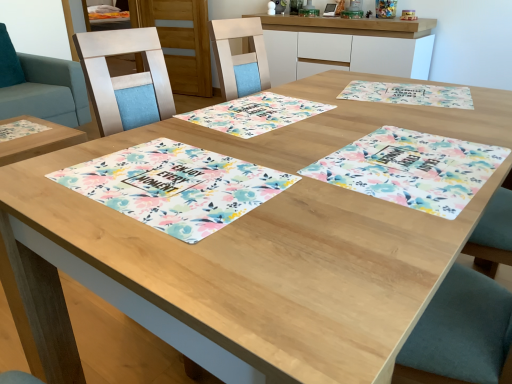
Measure the distance between floral fabric placemat at center, arranged as the 3th place mat when viewed from the right, and camera.

floral fabric placemat at center, arranged as the 3th place mat when viewed from the right, and camera are 3.64 feet apart from each other.

Measure the distance between point (300, 111) and camera.

They are 4.46 feet apart.

In order to click on floral fabric placemat at upper right, which is the fourth place mat in left-to-right order in this screenshot , I will do `click(408, 94)`.

This screenshot has width=512, height=384. What do you see at coordinates (408, 94) in the screenshot? I see `floral fabric placemat at upper right, marked as the first place mat in a right-to-left arrangement` at bounding box center [408, 94].

How much space does wooden cabinet at upper center, acting as the first cabinetry starting from the back, occupy horizontally?

It is 4.68 inches.

The height and width of the screenshot is (384, 512). Describe the element at coordinates (346, 46) in the screenshot. I see `white glossy cabinet at upper center, marked as the first cabinetry in a right-to-left arrangement` at that location.

This screenshot has height=384, width=512. I want to click on teal fabric swivel chair at upper left, so click(x=41, y=86).

This screenshot has height=384, width=512. Identify the location of floral fabric placemat at center, positioned as the third place mat in left-to-right order. (411, 169).

Based on their sizes in the image, would you say teal fabric swivel chair at upper left is bigger or smaller than floral fabric placemat at upper right, which is the fourth place mat in left-to-right order?

Considering their sizes, teal fabric swivel chair at upper left takes up more space than floral fabric placemat at upper right, which is the fourth place mat in left-to-right order.

Does teal fabric swivel chair at upper left have a lesser height compared to floral fabric placemat at upper right, which is the fourth place mat in left-to-right order?

In fact, teal fabric swivel chair at upper left may be taller than floral fabric placemat at upper right, which is the fourth place mat in left-to-right order.

Is floral fabric placemat at upper right, which is the fourth place mat in left-to-right order, inside teal fabric swivel chair at upper left?

No, teal fabric swivel chair at upper left does not contain floral fabric placemat at upper right, which is the fourth place mat in left-to-right order.

Considering the relative positions of white glossy cabinet at upper center, which is counted as the second cabinetry, starting from the left, and teal fabric swivel chair at upper left in the image provided, is white glossy cabinet at upper center, which is counted as the second cabinetry, starting from the left, to the left or to the right of teal fabric swivel chair at upper left?

white glossy cabinet at upper center, which is counted as the second cabinetry, starting from the left, is positioned on teal fabric swivel chair at upper left's right side.

Can you confirm if white glossy cabinet at upper center, which is counted as the second cabinetry, starting from the left, is shorter than teal fabric swivel chair at upper left?

Yes.

In the scene shown: From a real-world perspective, is white glossy cabinet at upper center, which is counted as the second cabinetry, starting from the left, under teal fabric swivel chair at upper left?

No, from a real-world perspective, white glossy cabinet at upper center, which is counted as the second cabinetry, starting from the left, is not below teal fabric swivel chair at upper left.

Measure the distance between white glossy cabinet at upper center, the 1th cabinetry viewed from the front, and teal fabric swivel chair at upper left.

white glossy cabinet at upper center, the 1th cabinetry viewed from the front, is 6.23 feet from teal fabric swivel chair at upper left.

In the scene shown: Between wooden cabinet at upper center, acting as the first cabinetry starting from the back, and floral fabric placemat at center, which is counted as the 4th place mat, starting from the right, which one has less height?

floral fabric placemat at center, which is counted as the 4th place mat, starting from the right.

Is floral fabric placemat at center, which is counted as the 4th place mat, starting from the right, completely or partially inside wooden cabinet at upper center, acting as the first cabinetry starting from the left?

No, floral fabric placemat at center, which is counted as the 4th place mat, starting from the right, is not a part of wooden cabinet at upper center, acting as the first cabinetry starting from the left.

Looking at this image, what's the angular difference between wooden cabinet at upper center, which ranks as the second cabinetry in right-to-left order, and floral fabric placemat at center, the 1th place mat when ordered from left to right,'s facing directions?

104 degrees separate the facing orientations of wooden cabinet at upper center, which ranks as the second cabinetry in right-to-left order, and floral fabric placemat at center, the 1th place mat when ordered from left to right.

Would you say floral fabric placemat at center, the 1th place mat when ordered from left to right, is a long distance from floral fabric placemat at upper right, which is the fourth place mat in left-to-right order?

That's not correct — floral fabric placemat at center, the 1th place mat when ordered from left to right, is a little close to floral fabric placemat at upper right, which is the fourth place mat in left-to-right order.

Looking at this image, considering the sizes of objects floral fabric placemat at center, which is counted as the 4th place mat, starting from the right, and floral fabric placemat at upper right, marked as the first place mat in a right-to-left arrangement, in the image provided, who is bigger, floral fabric placemat at center, which is counted as the 4th place mat, starting from the right, or floral fabric placemat at upper right, marked as the first place mat in a right-to-left arrangement,?

floral fabric placemat at center, which is counted as the 4th place mat, starting from the right.

From the image's perspective, which place mat is the 3rd one below the floral fabric placemat at upper right, marked as the first place mat in a right-to-left arrangement? Please provide its 2D coordinates.

[(175, 186)]

Is floral fabric placemat at center, the 1th place mat when ordered from left to right, looking in the opposite direction of floral fabric placemat at upper right, which is the fourth place mat in left-to-right order?

No, floral fabric placemat at center, the 1th place mat when ordered from left to right,'s orientation is not away from floral fabric placemat at upper right, which is the fourth place mat in left-to-right order.

Does white glossy cabinet at upper center, the 1th cabinetry viewed from the front, lie behind wooden cabinet at upper center, acting as the first cabinetry starting from the back?

No, white glossy cabinet at upper center, the 1th cabinetry viewed from the front, is closer to the viewer.

Locate an element on the screen. This screenshot has height=384, width=512. cabinetry that is in front of the wooden cabinet at upper center, which is the second cabinetry in front-to-back order is located at coordinates (346, 46).

Are white glossy cabinet at upper center, marked as the first cabinetry in a right-to-left arrangement, and wooden cabinet at upper center, which is the second cabinetry in front-to-back order, beside each other?

No, white glossy cabinet at upper center, marked as the first cabinetry in a right-to-left arrangement, is not touching wooden cabinet at upper center, which is the second cabinetry in front-to-back order.

Considering the relative sizes of white glossy cabinet at upper center, the 1th cabinetry viewed from the front, and wooden cabinet at upper center, which ranks as the second cabinetry in right-to-left order, in the image provided, is white glossy cabinet at upper center, the 1th cabinetry viewed from the front, wider than wooden cabinet at upper center, which ranks as the second cabinetry in right-to-left order,?

Correct, the width of white glossy cabinet at upper center, the 1th cabinetry viewed from the front, exceeds that of wooden cabinet at upper center, which ranks as the second cabinetry in right-to-left order.

Does floral fabric placemat at upper right, marked as the first place mat in a right-to-left arrangement, turn towards wooden cabinet at upper center, which ranks as the second cabinetry in right-to-left order?

No, floral fabric placemat at upper right, marked as the first place mat in a right-to-left arrangement, is not oriented towards wooden cabinet at upper center, which ranks as the second cabinetry in right-to-left order.

Looking at the image, does floral fabric placemat at upper right, which is the fourth place mat in left-to-right order, seem bigger or smaller compared to wooden cabinet at upper center, acting as the first cabinetry starting from the back?

floral fabric placemat at upper right, which is the fourth place mat in left-to-right order, is smaller than wooden cabinet at upper center, acting as the first cabinetry starting from the back.

Is floral fabric placemat at upper right, marked as the first place mat in a right-to-left arrangement, at the left side of wooden cabinet at upper center, acting as the first cabinetry starting from the back?

No.

Can you tell me how much floral fabric placemat at upper right, marked as the first place mat in a right-to-left arrangement, and wooden cabinet at upper center, acting as the first cabinetry starting from the left, differ in facing direction?

They differ by 86.1 degrees in their facing directions.

You are a GUI agent. You are given a task and a screenshot of the screen. Output one action in this format:
    pyautogui.click(x=<x>, y=<y>)
    Task: Click on the 3rd place mat above the teal fabric swivel chair at upper left (from a real-world perspective)
    Image resolution: width=512 pixels, height=384 pixels.
    Given the screenshot: What is the action you would take?
    pyautogui.click(x=411, y=169)

Is point (377, 145) closer or farther from the camera than point (10, 80)?

Point (377, 145) is positioned closer to the camera compared to point (10, 80).

In the scene shown: From the image's perspective, which is below, floral fabric placemat at center, which is the second place mat from right to left, or teal fabric swivel chair at upper left?

floral fabric placemat at center, which is the second place mat from right to left, from the image's perspective.

Is floral fabric placemat at center, which is the second place mat from right to left, closer to the viewer compared to teal fabric swivel chair at upper left?

That is True.

Find the location of a particular element. This screenshot has height=384, width=512. swivel chair below the floral fabric placemat at upper right, which is the fourth place mat in left-to-right order (from a real-world perspective) is located at coordinates (41, 86).

At what (x,y) coordinates should I click in order to perform the action: click on swivel chair on the left of the white glossy cabinet at upper center, the 1th cabinetry viewed from the front. Please return your answer as a coordinate pair (x, y). The height and width of the screenshot is (384, 512). Looking at the image, I should click on (41, 86).

Based on their spatial positions, is white glossy cabinet at upper center, marked as the first cabinetry in a right-to-left arrangement, or floral fabric placemat at center, which is the second place mat from right to left, further from floral fabric placemat at upper right, marked as the first place mat in a right-to-left arrangement?

Based on the image, white glossy cabinet at upper center, marked as the first cabinetry in a right-to-left arrangement, appears to be further to floral fabric placemat at upper right, marked as the first place mat in a right-to-left arrangement.

Looking at the image, which one is located further to floral fabric placemat at upper right, marked as the first place mat in a right-to-left arrangement, floral fabric placemat at center, which is the second place mat from right to left, or white glossy cabinet at upper center, the 1th cabinetry viewed from the front?

Based on the image, white glossy cabinet at upper center, the 1th cabinetry viewed from the front, appears to be further to floral fabric placemat at upper right, marked as the first place mat in a right-to-left arrangement.

Which object lies nearer to the anchor point floral fabric placemat at center, positioned as the third place mat in left-to-right order, wooden cabinet at upper center, acting as the first cabinetry starting from the left, or teal fabric swivel chair at upper left?

teal fabric swivel chair at upper left lies closer to floral fabric placemat at center, positioned as the third place mat in left-to-right order, than the other object.

Which object lies nearer to the anchor point floral fabric placemat at center, which is the second place mat from right to left, floral fabric placemat at center, which is counted as the 4th place mat, starting from the right, or floral fabric placemat at upper right, which is the fourth place mat in left-to-right order?

floral fabric placemat at center, which is counted as the 4th place mat, starting from the right, is closer to floral fabric placemat at center, which is the second place mat from right to left.

Considering their positions, is floral fabric placemat at center, the 1th place mat when ordered from left to right, positioned further to floral fabric placemat at center, positioned as the third place mat in left-to-right order, than floral fabric placemat at center, the second place mat in the left-to-right sequence?

Among the two, floral fabric placemat at center, the second place mat in the left-to-right sequence, is located further to floral fabric placemat at center, positioned as the third place mat in left-to-right order.

Estimate the real-world distances between objects in this image. Which object is closer to floral fabric placemat at upper right, which is the fourth place mat in left-to-right order, floral fabric placemat at center, which is counted as the 4th place mat, starting from the right, or teal fabric swivel chair at upper left?

floral fabric placemat at center, which is counted as the 4th place mat, starting from the right.

From the image, which object appears to be nearer to wooden cabinet at upper center, acting as the first cabinetry starting from the back, floral fabric placemat at upper right, which is the fourth place mat in left-to-right order, or floral fabric placemat at center, the 1th place mat when ordered from left to right?

Among the two, floral fabric placemat at upper right, which is the fourth place mat in left-to-right order, is located nearer to wooden cabinet at upper center, acting as the first cabinetry starting from the back.

When comparing their distances from floral fabric placemat at upper right, which is the fourth place mat in left-to-right order, does wooden cabinet at upper center, which is the second cabinetry in front-to-back order, or floral fabric placemat at center, arranged as the 3th place mat when viewed from the right, seem closer?

The object closer to floral fabric placemat at upper right, which is the fourth place mat in left-to-right order, is floral fabric placemat at center, arranged as the 3th place mat when viewed from the right.

The height and width of the screenshot is (384, 512). What are the coordinates of `swivel chair located between floral fabric placemat at upper right, which is the fourth place mat in left-to-right order, and wooden cabinet at upper center, acting as the first cabinetry starting from the left, in the depth direction` in the screenshot? It's located at (41, 86).

This screenshot has width=512, height=384. In order to click on place mat between floral fabric placemat at center, arranged as the 3th place mat when viewed from the right, and white glossy cabinet at upper center, which is counted as the second cabinetry, starting from the left, from front to back in this screenshot , I will do `click(408, 94)`.

Where is `swivel chair positioned between floral fabric placemat at center, positioned as the third place mat in left-to-right order, and wooden cabinet at upper center, which ranks as the second cabinetry in right-to-left order, from near to far`? swivel chair positioned between floral fabric placemat at center, positioned as the third place mat in left-to-right order, and wooden cabinet at upper center, which ranks as the second cabinetry in right-to-left order, from near to far is located at coordinates (41, 86).

Find the location of a particular element. cabinetry between floral fabric placemat at center, arranged as the 3th place mat when viewed from the right, and wooden cabinet at upper center, acting as the first cabinetry starting from the back, from front to back is located at coordinates (346, 46).